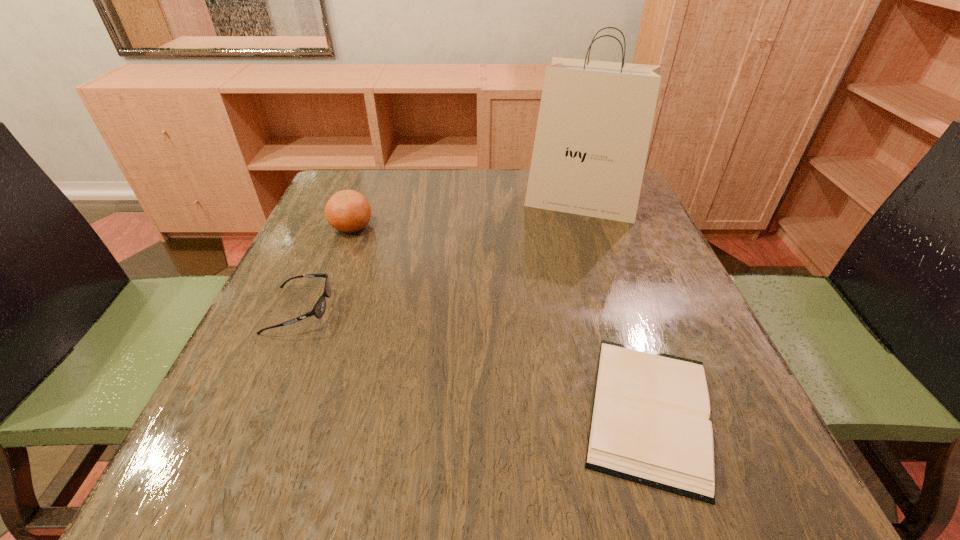
The image size is (960, 540). Identify the location of vacant region that satisfies the following two spatial constraints: 1. on the front side of the shopping bag; 2. on the front-facing side of the third tallest object. (616, 310).

Find the location of a particular element. This screenshot has width=960, height=540. free spot that satisfies the following two spatial constraints: 1. on the front-facing side of the shortest object; 2. on the left side of the sunglasses is located at coordinates (256, 410).

Where is `vacant area that satisfies the following two spatial constraints: 1. on the front-facing side of the sunglasses; 2. on the right side of the shortest object`? vacant area that satisfies the following two spatial constraints: 1. on the front-facing side of the sunglasses; 2. on the right side of the shortest object is located at coordinates (256, 410).

Locate an element on the screen. The width and height of the screenshot is (960, 540). free space that satisfies the following two spatial constraints: 1. on the front-facing side of the sunglasses; 2. on the back side of the hardback book is located at coordinates (256, 410).